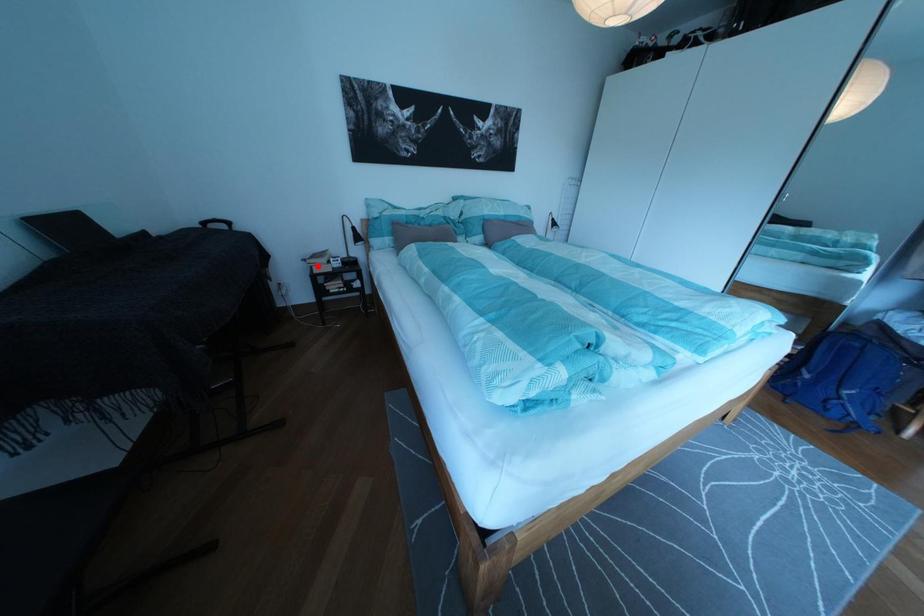
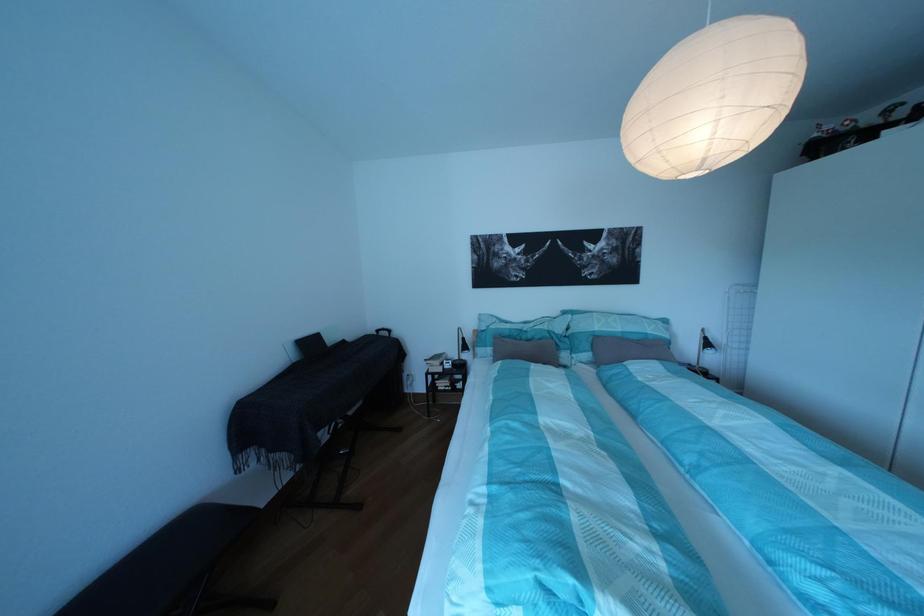
Where in the second image is the point corresponding to the highlighted location from the first image?

(439, 367)